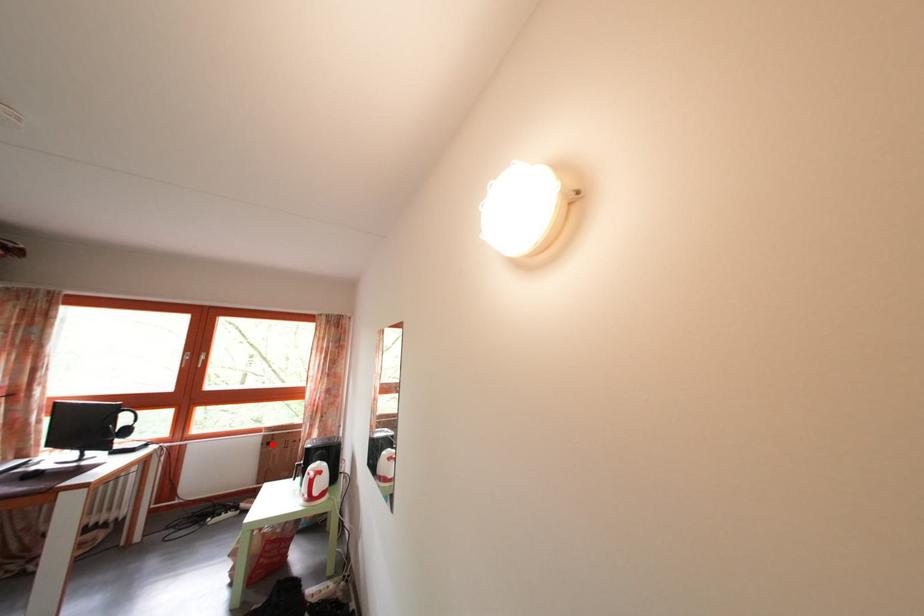
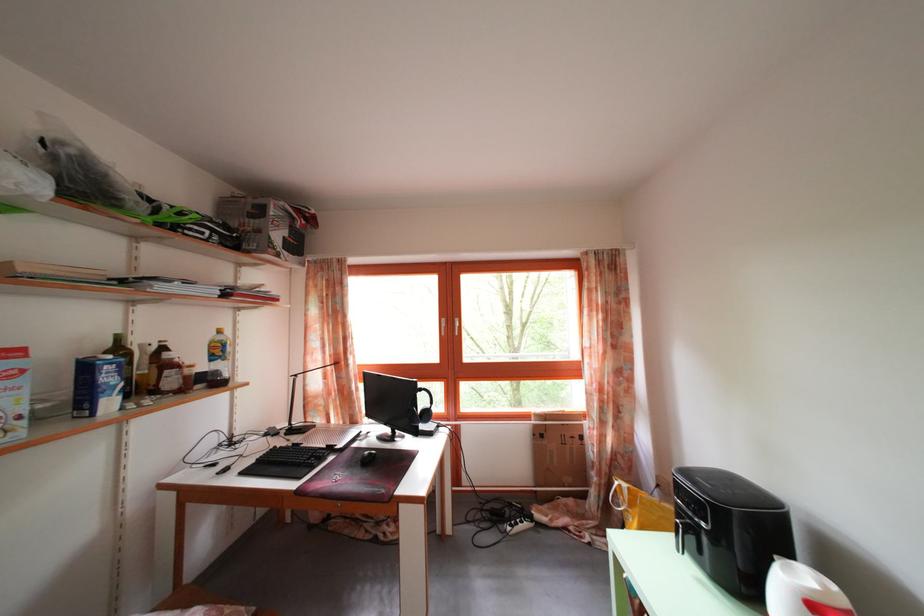
The point at the highlighted location is marked in the first image. Where is the corresponding point in the second image?

(542, 432)